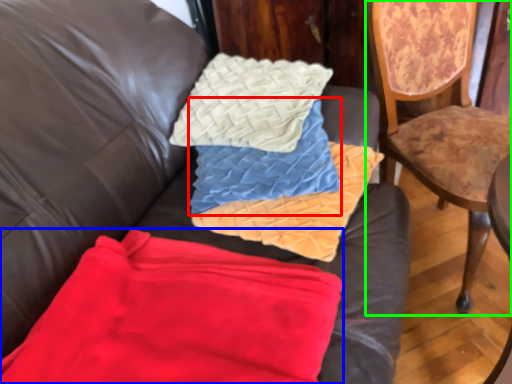
Question: Based on their relative distances, which object is nearer to pillow (highlighted by a red box)? Choose from material (highlighted by a blue box) and chair (highlighted by a green box).

Choices:
 (A) material
 (B) chair

Answer: (A)